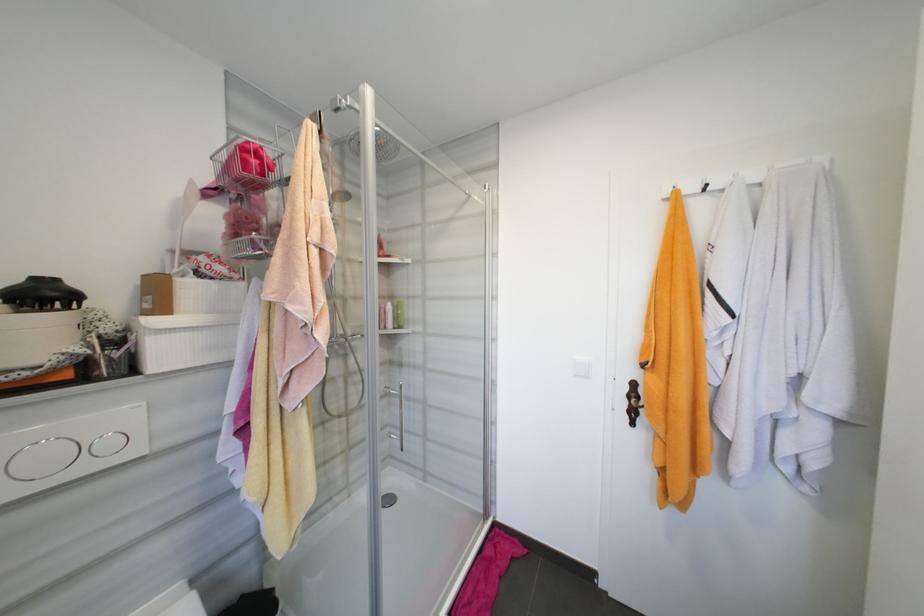
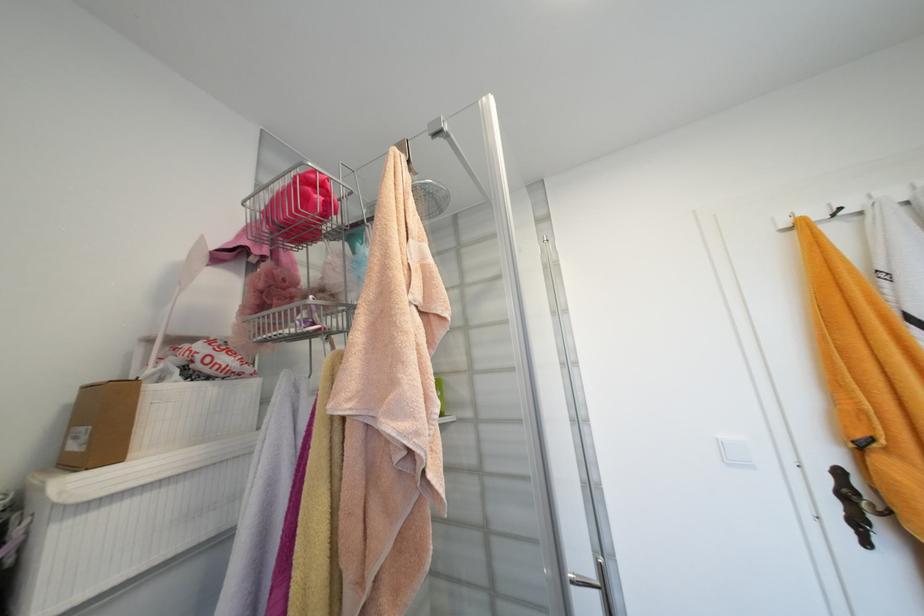
In the second image, find the point that corresponds to pixel 252 219 in the first image.

(289, 282)